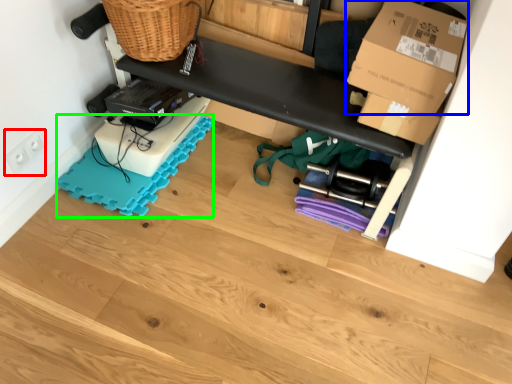
Question: Which object is the farthest from electric outlet (highlighted by a red box)? Choose among these: box (highlighted by a blue box) or yoga mat (highlighted by a green box).

Choices:
 (A) box
 (B) yoga mat

Answer: (A)